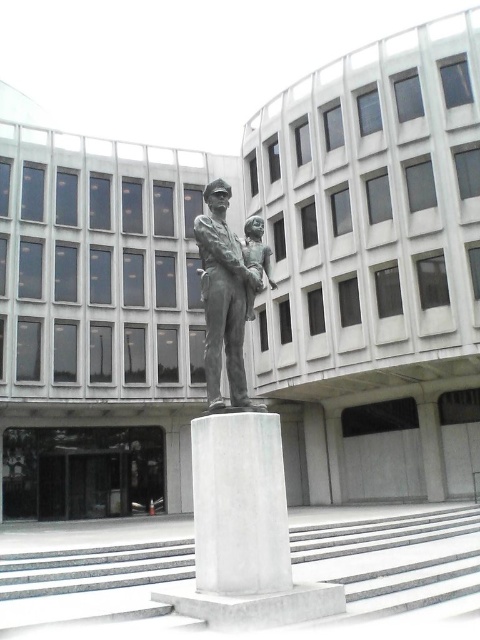
Can you confirm if white marble pillar at center is positioned above bronze statue at center?

No, white marble pillar at center is not above bronze statue at center.

Is white marble pillar at center below bronze statue at center?

Yes, white marble pillar at center is below bronze statue at center.

Between point (239, 449) and point (222, 204), which one is positioned behind?

The point (222, 204) is more distant.

Where is `white marble pillar at center`? The width and height of the screenshot is (480, 640). white marble pillar at center is located at coordinates (240, 504).